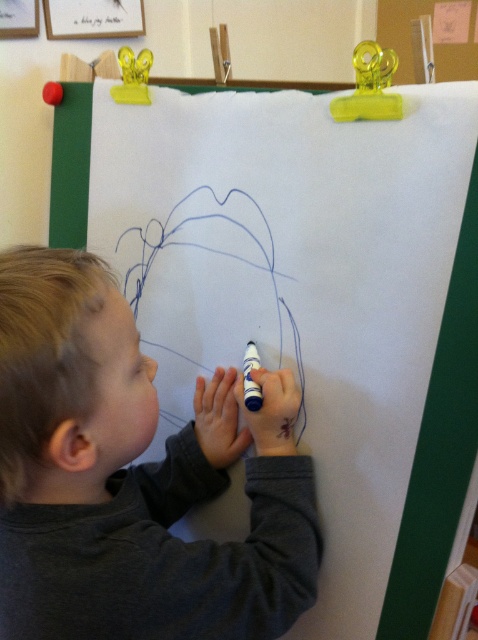
You are a photographer taking a picture of the child drawing. You notice two points on the paper marked as point 1 at coordinates point (220, 586) and point 2 at coordinates point (250, 342). Which point is closer to the camera?

Point (220, 586) is closer to the viewer than point (250, 342).

You are an art teacher observing a child drawing. You need to place a new red eraser between the dark gray sweater at lower left and the blue matte marker at lower center. Based on their sizes, where should you place the eraser so it doesn

The dark gray sweater at lower left is much taller than the blue matte marker at lower center, so the eraser should be placed between them at a position where it can fit between the taller sweater and shorter marker.